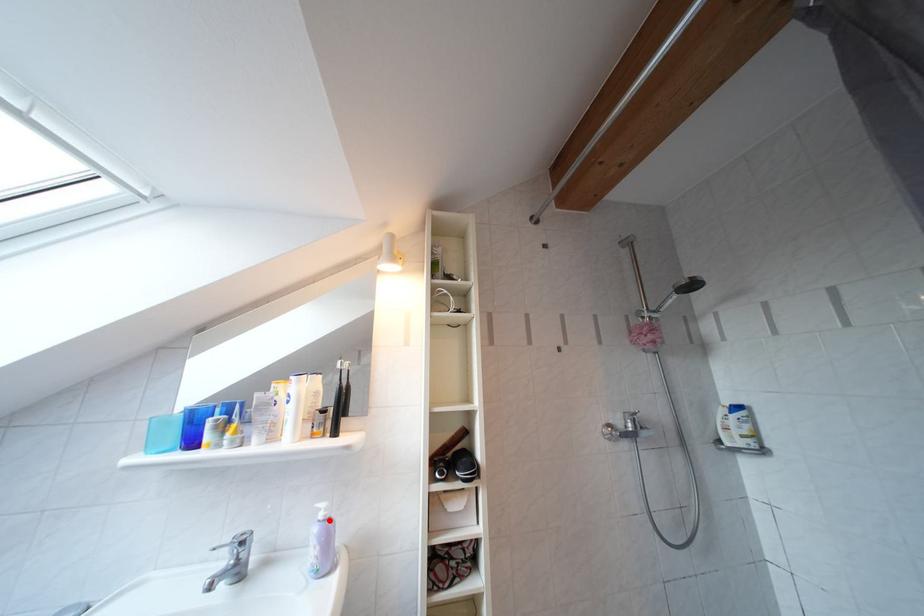
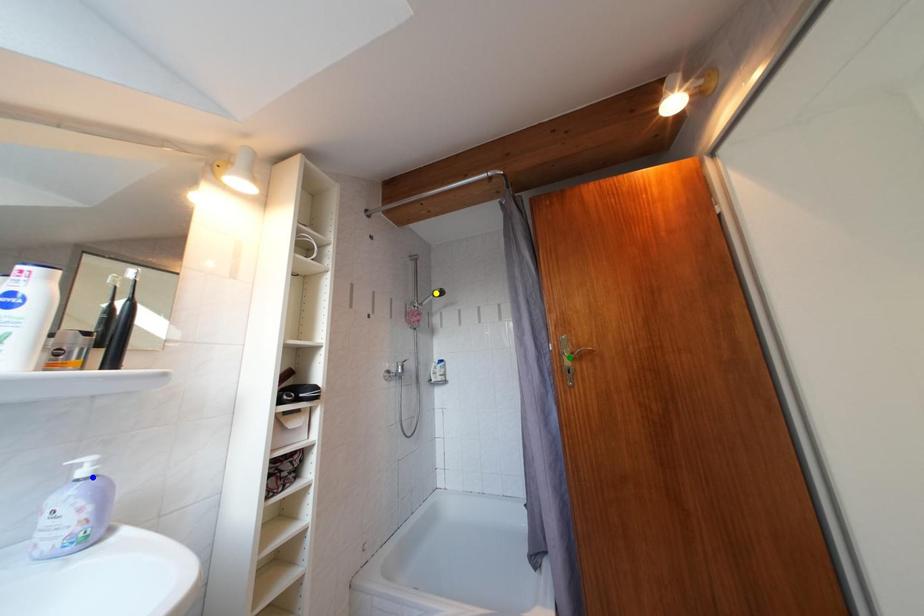
Question: I am providing you with two images of the same scene from different viewpoints. A red point is marked on the first image. You are given multiple points on the second image. Can you choose the point in image 2 that corresponds to the point in image 1?

Choices:
 (A) green point
 (B) yellow point
 (C) blue point

Answer: (C)